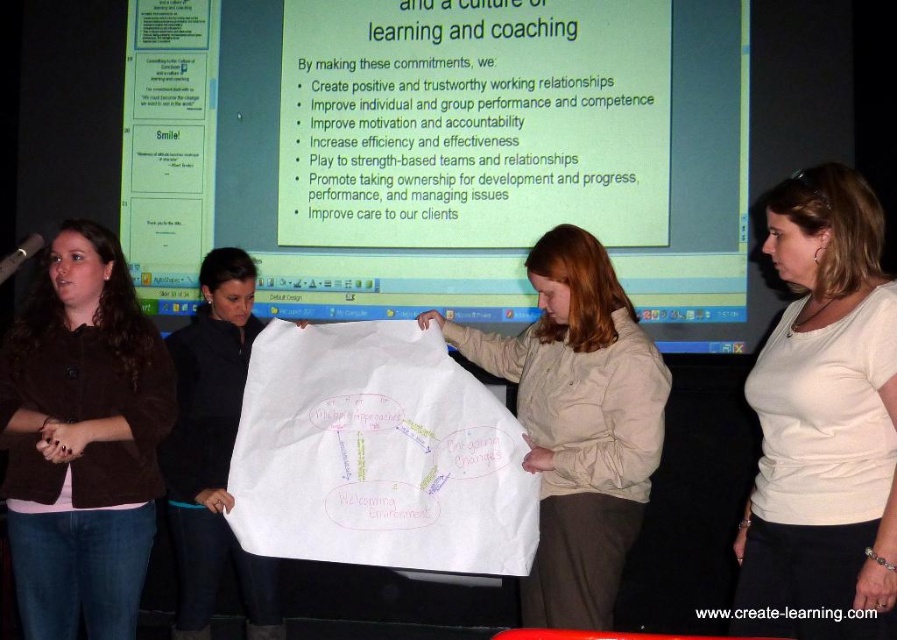
Question: Which point is farther from the camera taking this photo?

Choices:
 (A) (851, 452)
 (B) (594, 556)
 (C) (83, 545)
 (D) (199, 588)

Answer: (D)

Question: Does brown fabric jacket at left come in front of black fabric at center?

Choices:
 (A) yes
 (B) no

Answer: (A)

Question: In this image, where is brown fabric jacket at left located relative to black fabric at center?

Choices:
 (A) above
 (B) below

Answer: (A)

Question: Which object appears closest to the camera in this image?

Choices:
 (A) black fabric at center
 (B) brown fabric jacket at left
 (C) beige fabric paper at center

Answer: (B)

Question: Which is farther from the black fabric at center?

Choices:
 (A) beige fabric paper at center
 (B) brown fabric jacket at left
 (C) white cotton shirt at center

Answer: (C)

Question: Is brown fabric jacket at left smaller than black fabric at center?

Choices:
 (A) yes
 (B) no

Answer: (A)